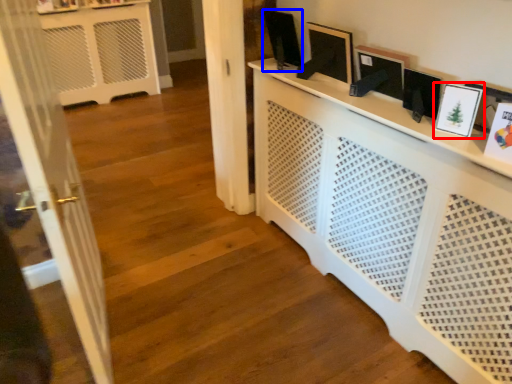
Question: Among these objects, which one is nearest to the camera, picture frame (highlighted by a red box) or picture frame (highlighted by a blue box)?

Choices:
 (A) picture frame
 (B) picture frame

Answer: (A)